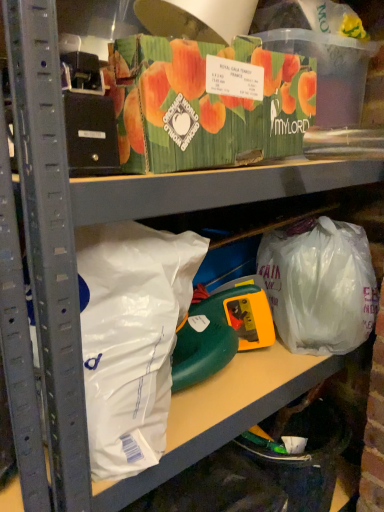
Question: Is white matte plastic bag at left, the 1th plastic bag positioned from the front, in front of or behind translucent plastic bag at lower right, arranged as the second plastic bag when viewed from the left, in the image?

Choices:
 (A) front
 (B) behind

Answer: (A)

Question: From the image's perspective, is white matte plastic bag at left, positioned as the second plastic bag in right-to-left order, above or below translucent plastic bag at lower right, the first plastic bag when ordered from right to left?

Choices:
 (A) above
 (B) below

Answer: (B)

Question: Looking at the image, does white matte plastic bag at left, positioned as the second plastic bag in back-to-front order, seem bigger or smaller compared to translucent plastic bag at lower right, the second plastic bag viewed from the front?

Choices:
 (A) small
 (B) big

Answer: (A)

Question: From the image's perspective, is translucent plastic bag at lower right, the first plastic bag when ordered from right to left, located above or below white matte plastic bag at left, positioned as the second plastic bag in back-to-front order?

Choices:
 (A) below
 (B) above

Answer: (B)

Question: From a real-world perspective, relative to white matte plastic bag at left, which is counted as the first plastic bag, starting from the left, is translucent plastic bag at lower right, arranged as the second plastic bag when viewed from the left, vertically above or below?

Choices:
 (A) below
 (B) above

Answer: (A)

Question: Visually, is translucent plastic bag at lower right, the first plastic bag when ordered from right to left, positioned to the left or to the right of white matte plastic bag at left, the 1th plastic bag positioned from the front?

Choices:
 (A) left
 (B) right

Answer: (B)

Question: Would you say translucent plastic bag at lower right, arranged as the second plastic bag when viewed from the left, is inside or outside white matte plastic bag at left, positioned as the second plastic bag in back-to-front order?

Choices:
 (A) outside
 (B) inside

Answer: (A)